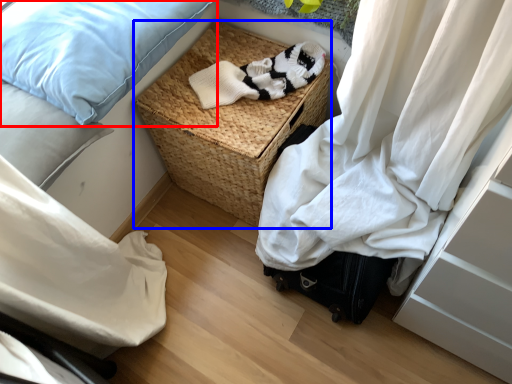
Question: Among these objects, which one is farthest to the camera, pillow (highlighted by a red box) or picnic basket (highlighted by a blue box)?

Choices:
 (A) pillow
 (B) picnic basket

Answer: (B)